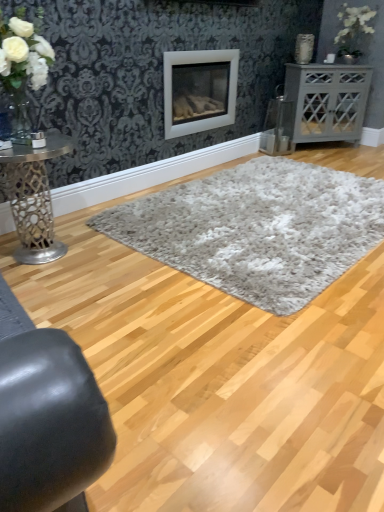
The image size is (384, 512). I want to click on vacant region to the right of metallic silver table at left, marked as the first table in a front-to-back arrangement, so click(x=110, y=274).